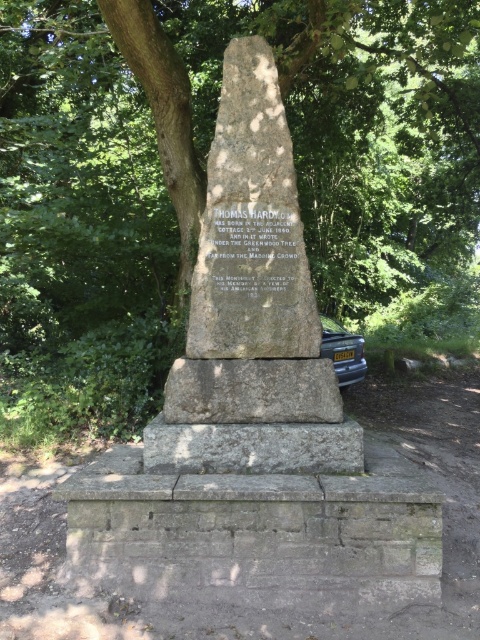
Question: Among these objects, which one is farthest from the camera?

Choices:
 (A) stone plaque at center
 (B) gray stone monument at center

Answer: (A)

Question: Does granite stone monument at center appear under metallic gray car at lower right?

Choices:
 (A) yes
 (B) no

Answer: (B)

Question: Does green leafy tree at center have a lesser width compared to granite stone monument at center?

Choices:
 (A) yes
 (B) no

Answer: (B)

Question: Is granite stone monument at center thinner than metallic gray car at lower right?

Choices:
 (A) no
 (B) yes

Answer: (A)

Question: Which point is closer to the camera?

Choices:
 (A) green leafy tree at center
 (B) gray stone monument at center

Answer: (B)

Question: Which point is farther to the camera?

Choices:
 (A) (340, 308)
 (B) (332, 468)

Answer: (A)